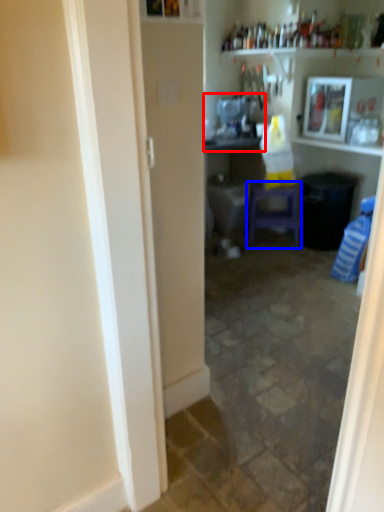
Question: Which point is closer to the camera, sink (highlighted by a red box) or furniture (highlighted by a blue box)?

Choices:
 (A) sink
 (B) furniture

Answer: (A)